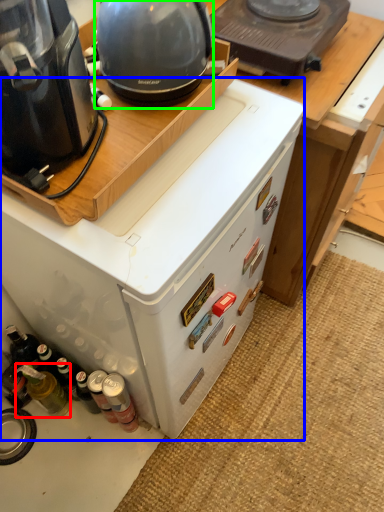
Question: Which object is positioned closest to bottle (highlighted by a red box)? Select from home appliance (highlighted by a blue box) and appliance (highlighted by a green box).

Choices:
 (A) home appliance
 (B) appliance

Answer: (A)